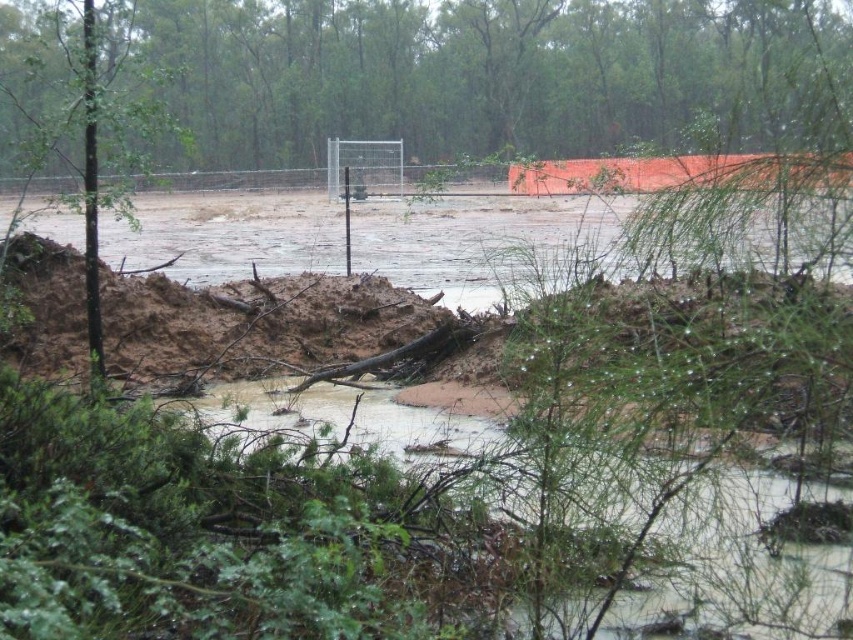
You are standing at point A and need to reach point B, which is located at the green matte fence at upper center. The coordinates of point B are given as point (490, 74). What is the direction you should head to reach point B from your current position at point A?

The green matte fence at upper center is located at point (490, 74), so you should head towards the upper center direction to reach it from point A.

Based on the scene description, which object occupies a larger area in the image? The green matte fence at upper center or the brown muddy water at center?

The green matte fence at upper center is bigger than the brown muddy water at center, so the green matte fence at upper center occupies a larger area in the image.